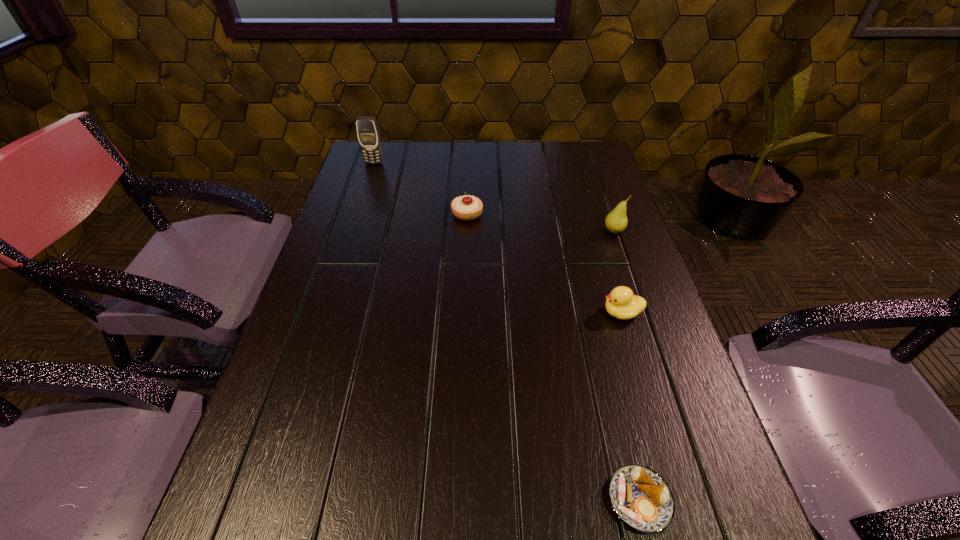
Where is `cellular telephone`? This screenshot has width=960, height=540. cellular telephone is located at coordinates (368, 134).

You are a GUI agent. You are given a task and a screenshot of the screen. Output one action in this format:
    pyautogui.click(x=<x>, y=<y>)
    Task: Click on the farthest object
    The image size is (960, 540).
    Given the screenshot: What is the action you would take?
    pyautogui.click(x=368, y=134)

Find the location of a particular element. the third nearest object is located at coordinates (616, 221).

At what (x,y) coordinates should I click in order to perform the action: click on pear. Please return your answer as a coordinate pair (x, y). This screenshot has width=960, height=540. Looking at the image, I should click on click(x=616, y=221).

Locate an element on the screen. This screenshot has width=960, height=540. duckling is located at coordinates (621, 303).

Locate an element on the screen. This screenshot has height=540, width=960. the second object from left to right is located at coordinates (466, 208).

Where is `the left pastry`? The height and width of the screenshot is (540, 960). the left pastry is located at coordinates (466, 208).

The width and height of the screenshot is (960, 540). Find the location of `the nearer pastry`. the nearer pastry is located at coordinates (640, 498).

The width and height of the screenshot is (960, 540). I want to click on the nearest object, so click(640, 498).

Where is `free space located 0.340m on the front face of the farthest object`? This screenshot has height=540, width=960. free space located 0.340m on the front face of the farthest object is located at coordinates (351, 231).